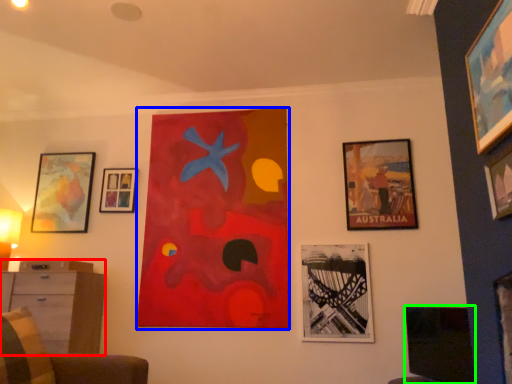
Question: Based on their relative distances, which object is nearer to dresser (highlighted by a red box)? Choose from picture frame (highlighted by a blue box) and picture frame (highlighted by a green box).

Choices:
 (A) picture frame
 (B) picture frame

Answer: (A)